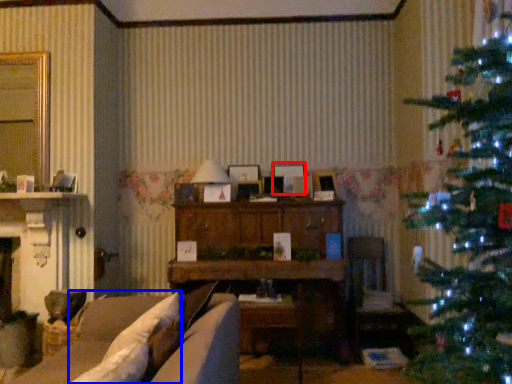
Question: Which object is closer to the camera taking this photo, picture frame (highlighted by a red box) or pillow (highlighted by a blue box)?

Choices:
 (A) picture frame
 (B) pillow

Answer: (B)